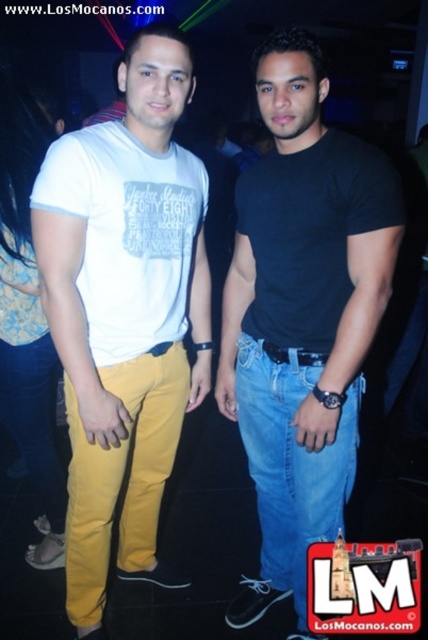
Question: Is black matte t-shirt at center positioned in front of blue denim jeans at center?

Choices:
 (A) yes
 (B) no

Answer: (A)

Question: Among these objects, which one is nearest to the camera?

Choices:
 (A) matte yellow pants at left
 (B) blue denim jeans at center
 (C) black matte t-shirt at center

Answer: (C)

Question: Which point is farther to the camera?

Choices:
 (A) (77, 630)
 (B) (267, 566)

Answer: (B)

Question: Does matte yellow pants at left have a greater width compared to black matte t-shirt at center?

Choices:
 (A) no
 (B) yes

Answer: (A)

Question: In this image, where is matte yellow pants at left located relative to black matte t-shirt at center?

Choices:
 (A) below
 (B) above

Answer: (B)

Question: Considering the real-world distances, which object is closest to the matte yellow pants at left?

Choices:
 (A) blue denim jeans at center
 (B) black matte t-shirt at center

Answer: (B)